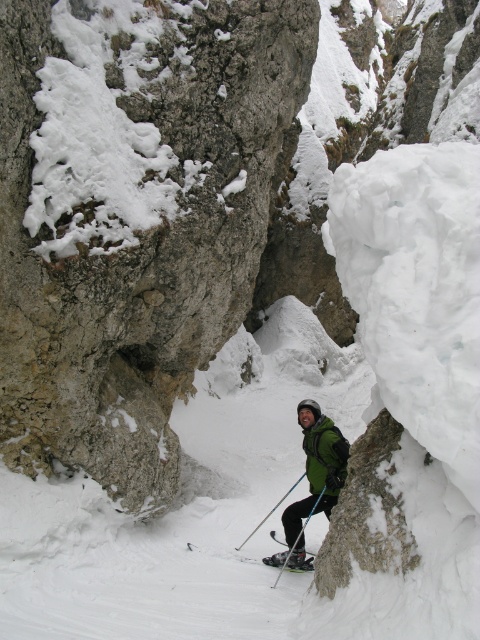
Does matte black ski at center appear on the left side of blue metallic ski pole at center?

Incorrect, matte black ski at center is not on the left side of blue metallic ski pole at center.

The image size is (480, 640). Describe the element at coordinates (291, 564) in the screenshot. I see `matte black ski at center` at that location.

The image size is (480, 640). Identify the location of matte black ski at center. (291, 564).

Who is positioned more to the left, green matte jacket at center or matte black ski pole at center?

Positioned to the left is matte black ski pole at center.

Is green matte jacket at center thinner than matte black ski pole at center?

Correct, green matte jacket at center's width is less than matte black ski pole at center's.

Between point (319, 426) and point (283, 563), which one is positioned in front?

Point (319, 426) is more forward.

Find the location of a particular element. The width and height of the screenshot is (480, 640). green matte jacket at center is located at coordinates (324, 456).

Who is higher up, green matte jacket at center or blue metallic ski pole at center?

green matte jacket at center is above.

Is point (333, 442) positioned after point (271, 512)?

That is False.

Describe the element at coordinates (324, 456) in the screenshot. I see `green matte jacket at center` at that location.

Locate an element on the screen. This screenshot has width=480, height=640. green matte jacket at center is located at coordinates (324, 456).